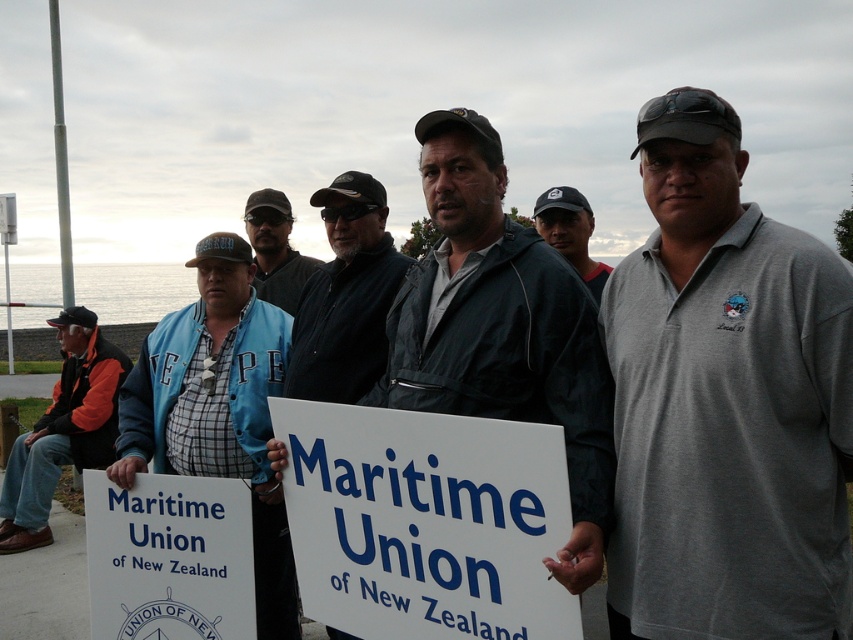
From the picture: You are a photographer trying to capture a photo of the gray cotton polo shirt at center and the dark gray jacket at center. Since you want to focus on the details of the clothing items, which one should you zoom in on more to ensure it doesn not appear too small in the frame?

The gray cotton polo shirt at center has a lesser width compared to the dark gray jacket at center, so you should zoom in more on the gray cotton polo shirt at center to ensure it doesn not appear too small in the frame.

In the scene described, there are two items of note among the group of men near the water. The blue fabric jacket at center and the white paper sign at lower left. Which of these two items is bigger in size?

The blue fabric jacket at center is larger in size compared to the white paper sign at lower left.

You are a photographer trying to capture the Maritime Union of New Zealand sign held by the men in the scene. The sign is located at point [425,522]. If you want to ensure the sign is centered in your photo, where should you aim your camera?

The white paper sign at center is located at point [425,522], so you should aim your camera at that coordinate to center the sign in your photo.